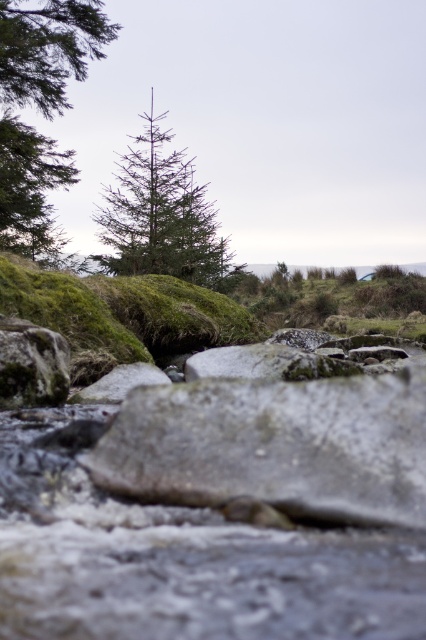
Looking at this image, you are standing at point A and want to walk to point B. You see two points marked as point(158, 236) and point(54, 401). Which point should you head towards first?

You should head towards point(54, 401) first because point(158, 236) is behind it, meaning point(54, 401) is closer to you.

Based on the photo, you are a hiker trying to cross a rocky stream. You see a gray rough boulder at center and a green matte tree at center. Which object is narrower, and can you step on the narrower one?

The gray rough boulder at center is narrower than the green matte tree at center. Since it is narrower, you can step on the gray rough boulder at center if it is stable enough.

You are standing at the origin point of the coordinate system in this natural scene. You want to walk towards the green matte tree at center. What are the coordinates you should head towards?

The coordinates you should head towards are 0.341 in the x direction and 0.380 in the y direction.